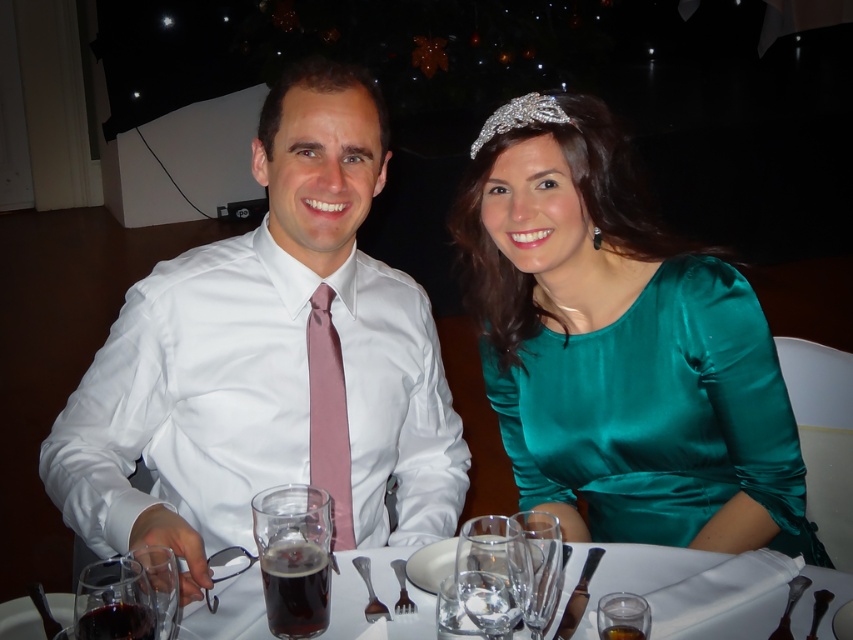
How far apart are white satin shirt at left and transparent glass at lower center?

The distance of white satin shirt at left from transparent glass at lower center is 20.34 inches.

Who is higher up, white satin shirt at left or transparent glass at lower center?

white satin shirt at left

Who is more forward, (115, 524) or (479, 616)?

Positioned in front is point (479, 616).

Find the location of a particular element. This screenshot has height=640, width=853. white satin shirt at left is located at coordinates 270,362.

Which is below, dark amber liquid at center or clear glass wine glass at center?

dark amber liquid at center

Measure the distance between point [265,560] and camera.

Point [265,560] is 32.67 inches from camera.

The image size is (853, 640). Identify the location of dark amber liquid at center. (294, 588).

Can you confirm if clear crystal tiara at upper center is bigger than clear glass at lower right?

Correct, clear crystal tiara at upper center is larger in size than clear glass at lower right.

Between clear crystal tiara at upper center and clear glass at lower right, which one appears on the right side from the viewer's perspective?

Answer: clear glass at lower right

Identify the location of clear crystal tiara at upper center. Image resolution: width=853 pixels, height=640 pixels. (519, 116).